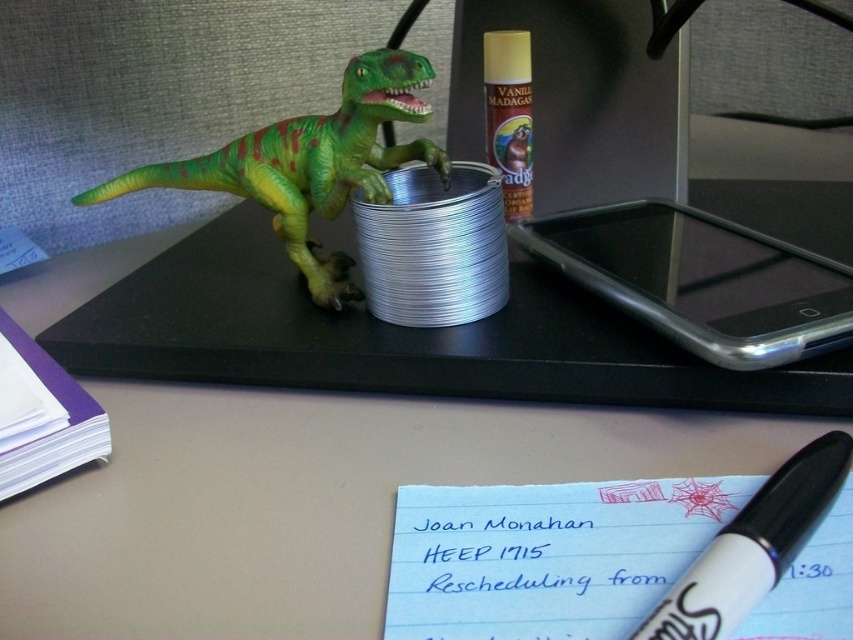
You are organizing the desk and need to place a new item between the green matte plastic dinosaur at upper left and the white marker pen at lower right. Considering their heights, which one should you place the new item closer to?

Since the green matte plastic dinosaur at upper left is much taller than the white marker pen at lower right, you should place the new item closer to the white marker pen at lower right to maintain stability and avoid tipping over.